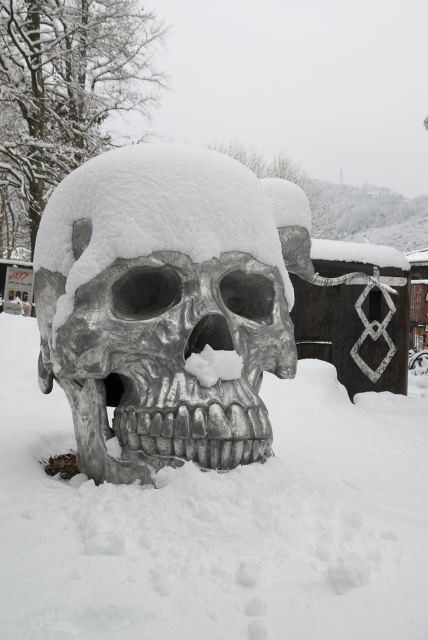
Question: Is white frosty skull at center smaller than slick silver skull at center?

Choices:
 (A) yes
 (B) no

Answer: (A)

Question: Can you confirm if white frosty skull at center is positioned above slick silver skull at center?

Choices:
 (A) yes
 (B) no

Answer: (B)

Question: Can you confirm if white frosty skull at center is positioned to the right of slick silver skull at center?

Choices:
 (A) no
 (B) yes

Answer: (A)

Question: Which point is closer to the camera?

Choices:
 (A) (225, 438)
 (B) (142, 556)

Answer: (B)